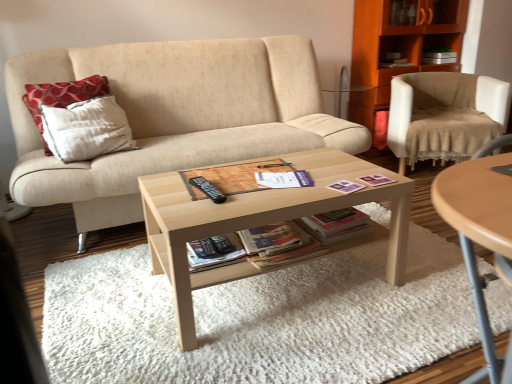
Question: Which direction should I rotate to look at black matte paperback book at center, the 1th paperback book in the left-to-right sequence, — up or down?

Choices:
 (A) up
 (B) down

Answer: (B)

Question: Considering the relative positions of beige fabric chair at right and white paper at center in the image provided, is beige fabric chair at right to the right of white paper at center from the viewer's perspective?

Choices:
 (A) yes
 (B) no

Answer: (A)

Question: Is beige fabric chair at right bigger than white paper at center?

Choices:
 (A) no
 (B) yes

Answer: (B)

Question: Can white paper at center be found inside beige fabric chair at right?

Choices:
 (A) yes
 (B) no

Answer: (B)

Question: Does beige fabric chair at right have a lesser width compared to white paper at center?

Choices:
 (A) no
 (B) yes

Answer: (A)

Question: From the image's perspective, is beige fabric chair at right beneath white paper at center?

Choices:
 (A) no
 (B) yes

Answer: (A)

Question: Is beige fabric chair at right with white paper at center?

Choices:
 (A) yes
 (B) no

Answer: (B)

Question: Is light wood coffee table at center smaller than light wood/texture coffee table at center?

Choices:
 (A) no
 (B) yes

Answer: (B)

Question: Is light wood coffee table at center next to light wood/texture coffee table at center and touching it?

Choices:
 (A) no
 (B) yes

Answer: (A)

Question: Is light wood coffee table at center thinner than light wood/texture coffee table at center?

Choices:
 (A) no
 (B) yes

Answer: (A)

Question: From a real-world perspective, does light wood coffee table at center stand above light wood/texture coffee table at center?

Choices:
 (A) yes
 (B) no

Answer: (B)

Question: Considering the relative positions of light wood coffee table at center and light wood/texture coffee table at center in the image provided, is light wood coffee table at center to the left of light wood/texture coffee table at center from the viewer's perspective?

Choices:
 (A) no
 (B) yes

Answer: (B)

Question: Is light wood coffee table at center oriented towards light wood/texture coffee table at center?

Choices:
 (A) yes
 (B) no

Answer: (B)

Question: Considering the relative sizes of light wood/texture coffee table at center and beige fabric couch at center in the image provided, is light wood/texture coffee table at center wider than beige fabric couch at center?

Choices:
 (A) yes
 (B) no

Answer: (A)